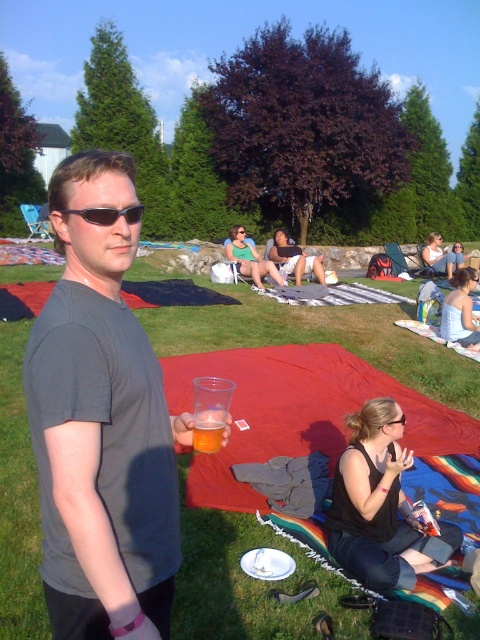
Is green grass at center smaller than white fabric dress at lower right?

No.

Between point (453, 404) and point (472, 340), which one is positioned in front?

Point (453, 404) is in front.

Where is `green grass at center`? The width and height of the screenshot is (480, 640). green grass at center is located at coordinates (297, 332).

Who is shorter, matte gray t-shirt at center or white fabric dress at lower right?

With less height is white fabric dress at lower right.

Is matte gray t-shirt at center shorter than white fabric dress at lower right?

No.

The height and width of the screenshot is (640, 480). I want to click on matte gray t-shirt at center, so click(x=100, y=424).

What are the coordinates of `matte gray t-shirt at center` in the screenshot? It's located at (100, 424).

Does green grass at center have a smaller size compared to black plastic sunglasses at center?

No.

Looking at this image, which is more to the left, green grass at center or black plastic sunglasses at center?

black plastic sunglasses at center is more to the left.

Is point (298, 570) closer to viewer compared to point (131, 216)?

No, (298, 570) is behind (131, 216).

Locate an element on the screen. The width and height of the screenshot is (480, 640). green grass at center is located at coordinates (297, 332).